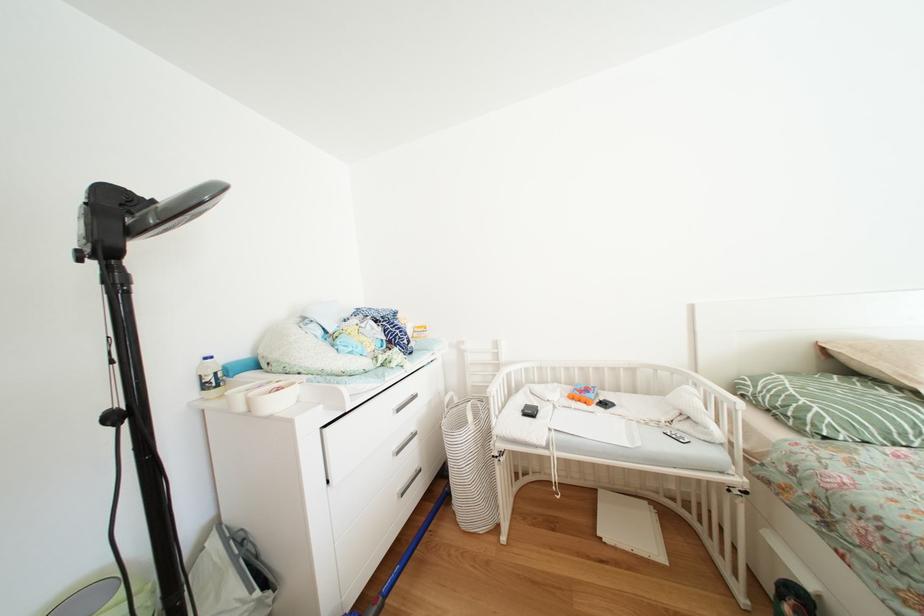
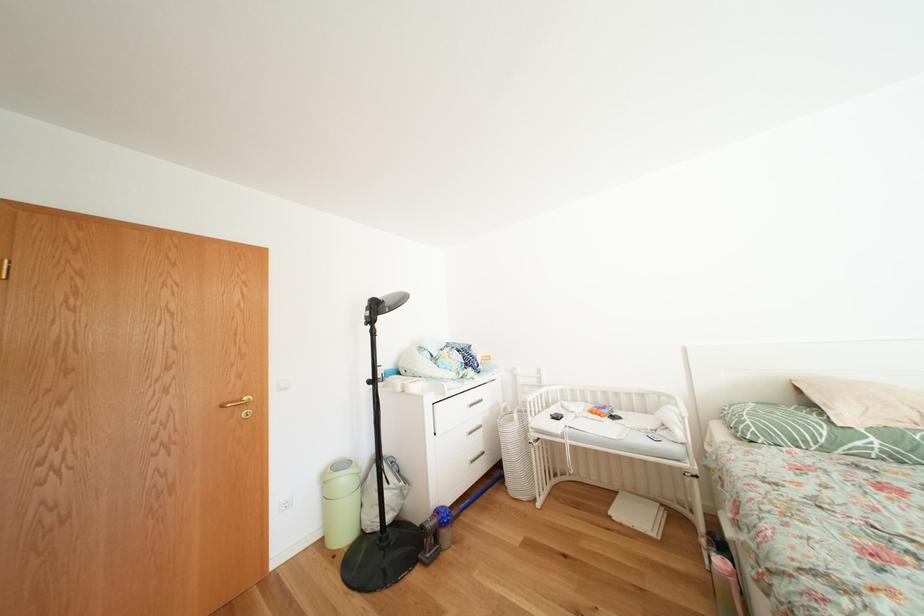
Question: Which direction would the cameraman need to move to produce the second image? Reply with the corresponding letter.

Choices:
 (A) Left
 (B) Right
 (C) Forward
 (D) Backward

Answer: (D)